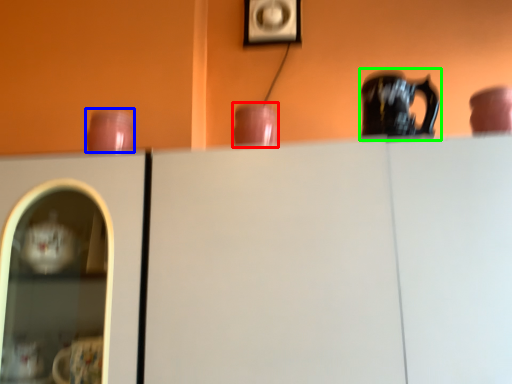
Question: Which object is the closest to the tableware (highlighted by a red box)? Choose among these: tableware (highlighted by a blue box) or jug (highlighted by a green box).

Choices:
 (A) tableware
 (B) jug

Answer: (B)